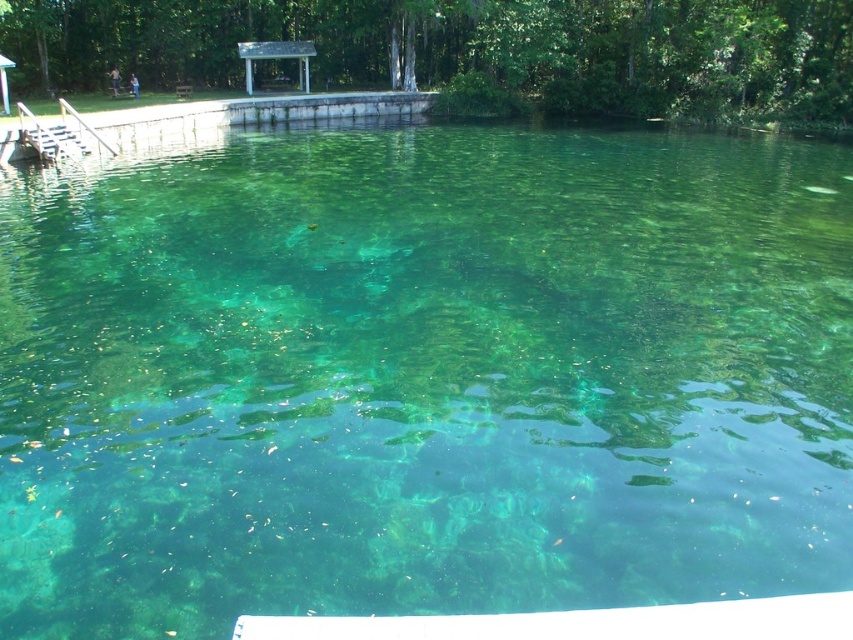
Question: Which point is closer to the camera?

Choices:
 (A) (47, 141)
 (B) (259, 54)

Answer: (A)

Question: Is wooden dock at left positioned in front of white wooden gazebo at upper center?

Choices:
 (A) yes
 (B) no

Answer: (A)

Question: Does wooden dock at left appear over white wooden gazebo at upper center?

Choices:
 (A) yes
 (B) no

Answer: (B)

Question: Which of the following is the farthest from the observer?

Choices:
 (A) (42, 145)
 (B) (248, 80)

Answer: (B)

Question: Does wooden dock at left have a larger size compared to white wooden gazebo at upper center?

Choices:
 (A) yes
 (B) no

Answer: (B)

Question: Among these points, which one is farthest from the camera?

Choices:
 (A) (59, 104)
 (B) (286, 45)

Answer: (B)